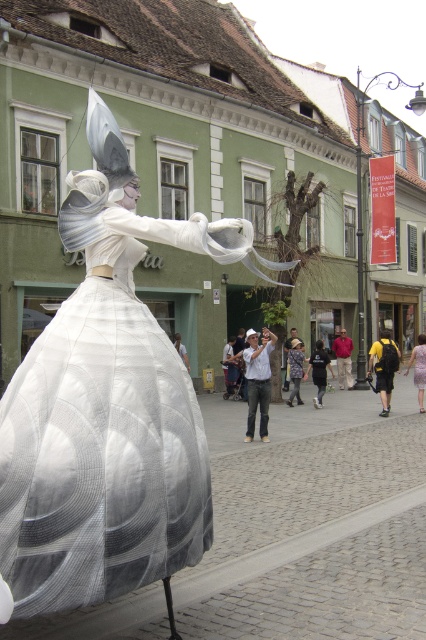
Who is more distant from viewer, (244,356) or (296,381)?

The point (296,381) is behind.

Between white fabric street artist at center and floral-patterned dress at center, which one is positioned higher?

white fabric street artist at center is above.

Does point (262, 358) come closer to viewer compared to point (299, 378)?

Yes, it is.

Identify the location of white fabric street artist at center. Image resolution: width=426 pixels, height=640 pixels. (258, 380).

Does white sheer dress at center have a greater height compared to matte white dress at center?

Yes.

Between point (140, 525) and point (423, 368), which one is positioned in front?

Point (140, 525) is in front.

Does point (29, 461) come farther from viewer compared to point (419, 372)?

That is False.

You are a GUI agent. You are given a task and a screenshot of the screen. Output one action in this format:
    pyautogui.click(x=<x>, y=<y>)
    Task: Click on the white sheer dress at center
    
    Given the screenshot: What is the action you would take?
    pyautogui.click(x=103, y=442)

Does white fabric street artist at center appear on the left side of black cotton t-shirt at center?

Indeed, white fabric street artist at center is positioned on the left side of black cotton t-shirt at center.

Does white fabric street artist at center appear over black cotton t-shirt at center?

Yes.

Who is more forward, (261, 422) or (322, 392)?

Point (261, 422)

Locate an element on the screen. This screenshot has width=426, height=640. white fabric street artist at center is located at coordinates (258, 380).